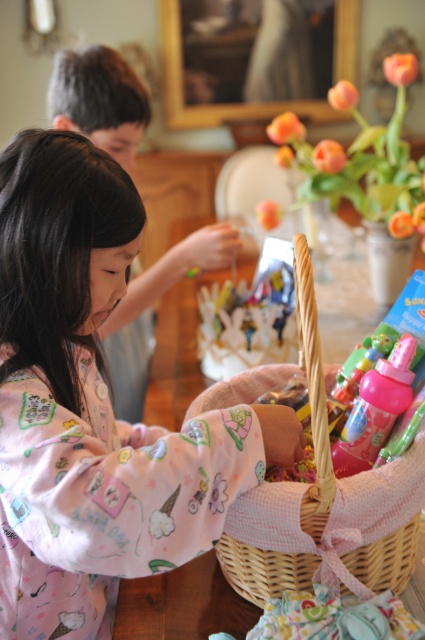
You are helping organize the toys in the woven wicker basket at center and the pink fabric at center. If you want to place a tall stuffed animal inside one of them, which container can fit it better?

The pink fabric at center can fit the tall stuffed animal better because the woven wicker basket at center is not as tall as the pink fabric at center.

What is the location of the point with coordinates (93, 406) in the image?

The point with coordinates (93, 406) is located on the pink cotton pajamas at left.

You are a parent trying to organize your childen s toys. You see the pink cotton pajamas at left and the woven wicker basket at center. Which item is located to the left of the other?

The pink cotton pajamas at left is positioned on the left side of woven wicker basket at center, so the pink cotton pajamas at left is to the left of the woven wicker basket at center.